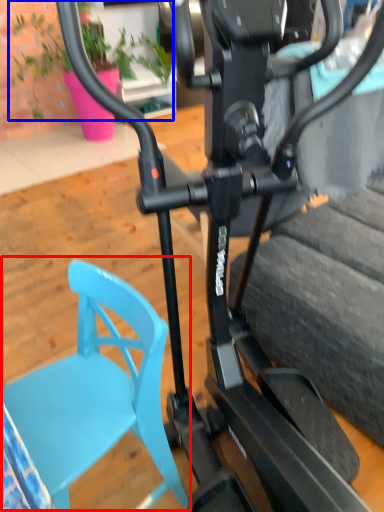
Question: Which of the following is the farthest to the observer, swivel chair (highlighted by a red box) or plant (highlighted by a blue box)?

Choices:
 (A) swivel chair
 (B) plant

Answer: (B)